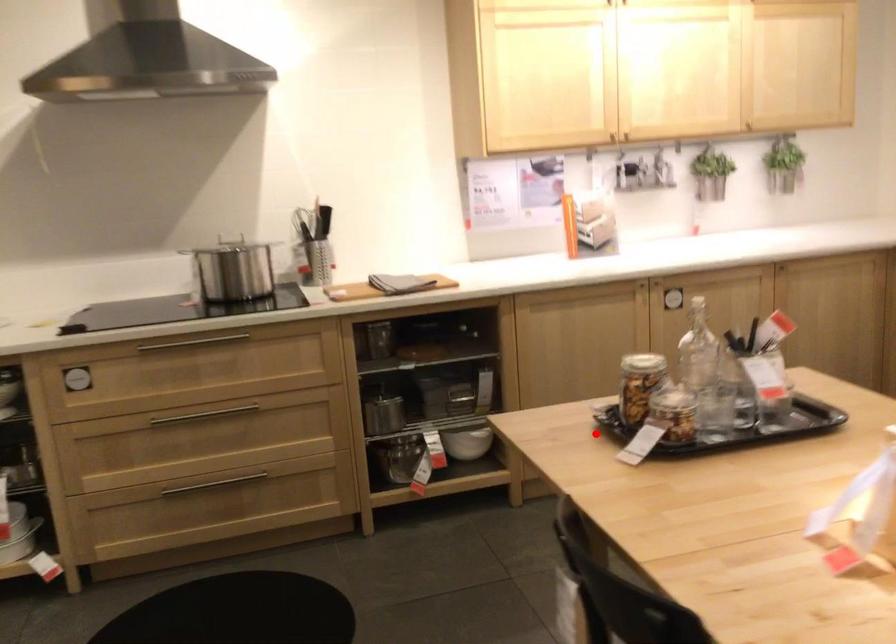
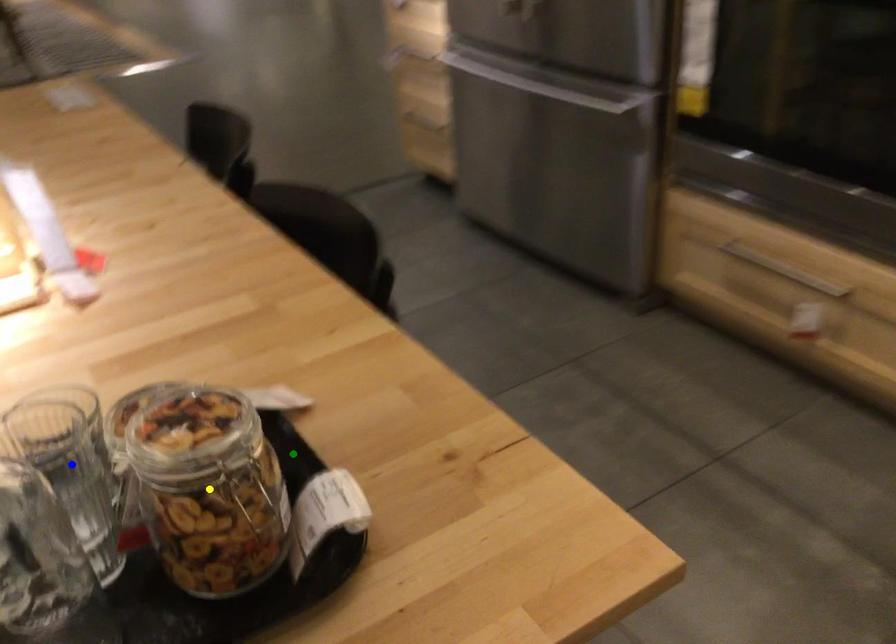
Question: I am providing you with two images of the same scene from different viewpoints. A red point is marked on the first image. You are given multiple points on the second image. In image 2, which mark is for the same physical point as the one in image 1?

Choices:
 (A) blue point
 (B) yellow point
 (C) green point

Answer: (C)